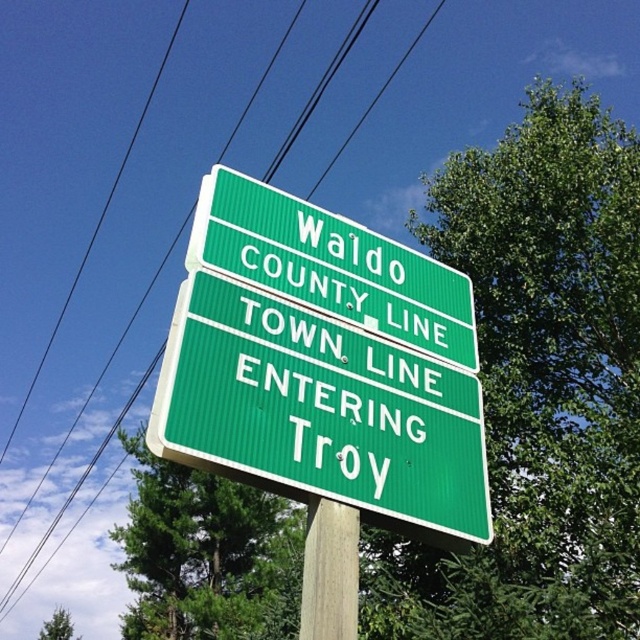
Question: Is green ribbed sign at center closer to camera compared to green matte sign at upper center?

Choices:
 (A) yes
 (B) no

Answer: (A)

Question: Considering the real-world distances, which object is farthest from the black wire at upper center?

Choices:
 (A) green leafy tree at center
 (B) wooden post at center

Answer: (B)

Question: Which object appears farthest from the camera in this image?

Choices:
 (A) black wire at upper center
 (B) green matte sign at upper center
 (C) green leafy tree at lower left
 (D) wooden post at center

Answer: (C)

Question: Is green ribbed sign at center below green leafy tree at lower left?

Choices:
 (A) yes
 (B) no

Answer: (B)

Question: Which object is the closest to the green matte sign at upper center?

Choices:
 (A) green leafy tree at center
 (B) green ribbed sign at center

Answer: (B)

Question: Is green leafy tree at center to the left of wooden post at center from the viewer's perspective?

Choices:
 (A) no
 (B) yes

Answer: (B)